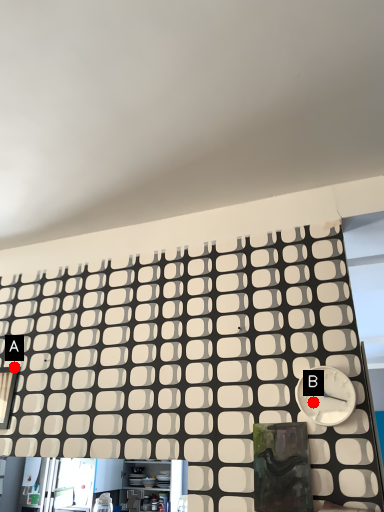
Question: Two points are circled on the image, labeled by A and B beside each circle. Which point is farther from the camera taking this photo?

Choices:
 (A) A is further
 (B) B is further

Answer: (A)